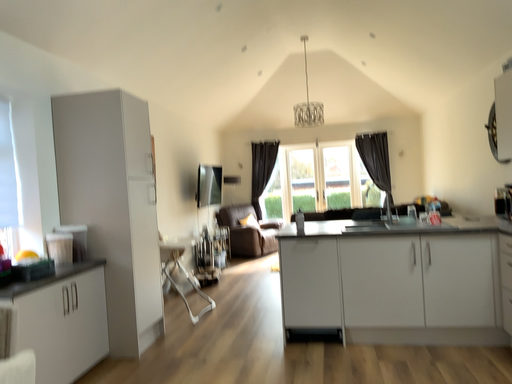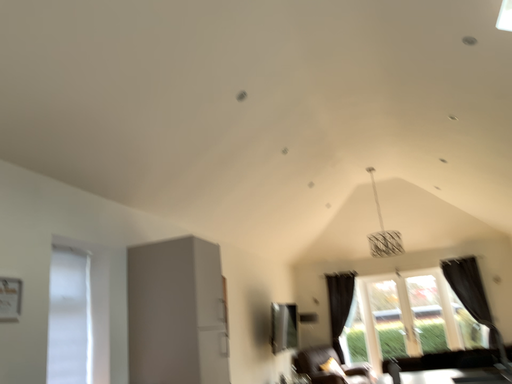
Question: Which way did the camera rotate in the video?

Choices:
 (A) rotated right
 (B) rotated left

Answer: (B)